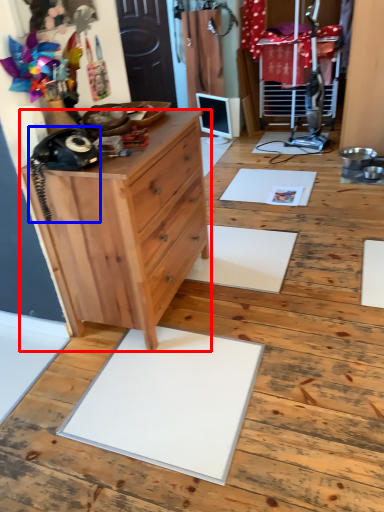
Question: Which object is further to the camera taking this photo, chest of drawers (highlighted by a red box) or equipment (highlighted by a blue box)?

Choices:
 (A) chest of drawers
 (B) equipment

Answer: (A)